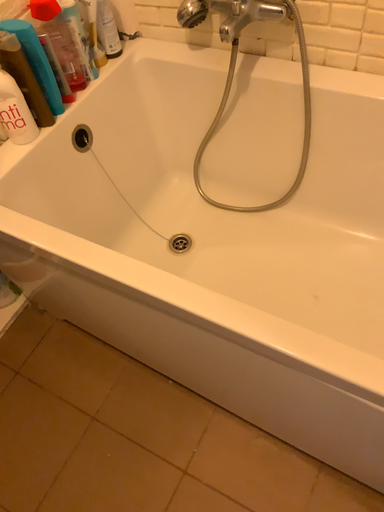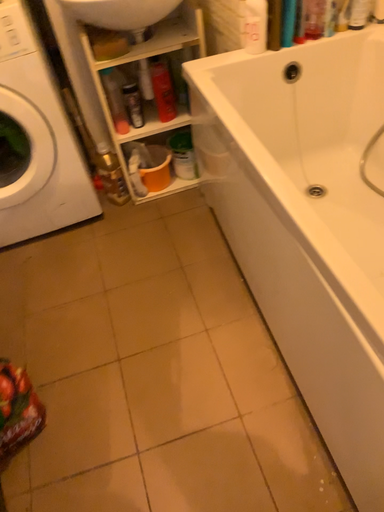
Question: How did the camera likely rotate when shooting the video?

Choices:
 (A) rotated downward
 (B) rotated upward

Answer: (B)